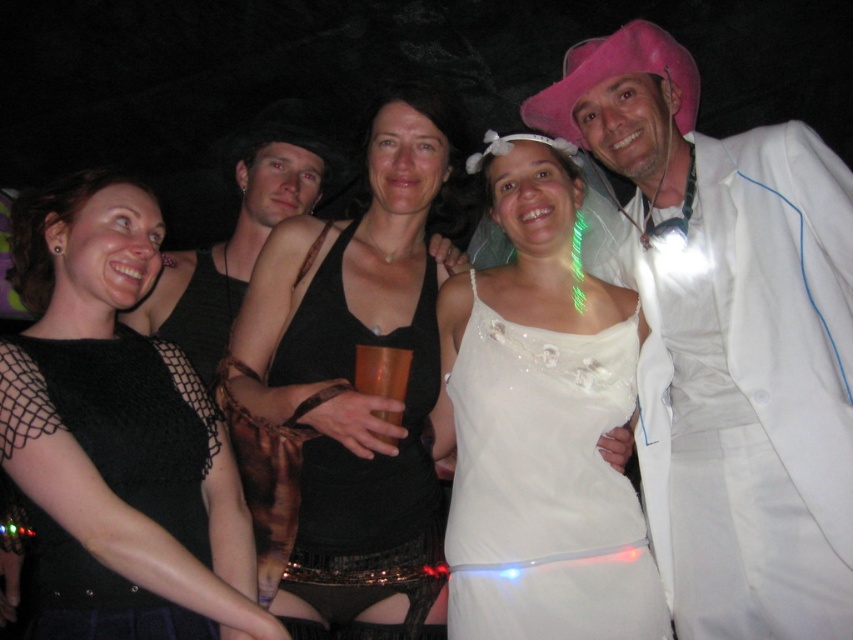
You are a photographer adjusting your camera settings to capture a clear shot of both the white satin dress at center and the black leather hat at upper center. Given that your camera has a depth of field that can sharply focus on objects within a 30 inch range, will both items be in focus simultaneously?

The distance between the white satin dress at center and the black leather hat at upper center is 35.16 inches, which exceeds the camera sensor depth of field range of 30 inches. Therefore, both items cannot be in focus at the same time.

You are planning to take a photo of the group in the scene described. You need to ensure that the white satin dress at center and the black leather hat at upper center are both clearly visible. Given their sizes, which object might require you to adjust your camera angle to avoid being too small in the frame?

The white satin dress at center occupies less space than the black leather hat at upper center, so the white satin dress at center might require adjusting the camera angle to ensure it isn not too small in the frame.